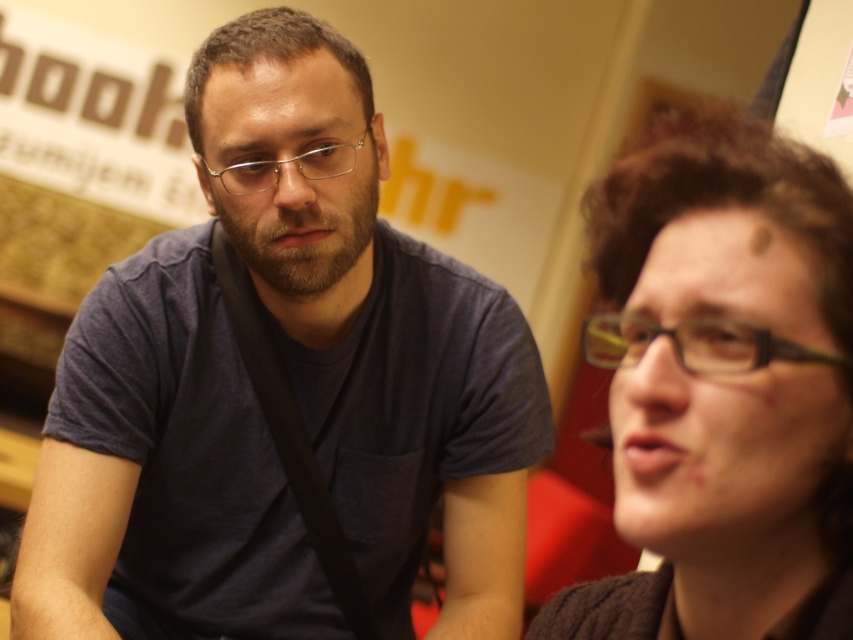
You are a photographer trying to capture a closeup shot of the metallic frame glasses at center and the matte black hair at right. Since the camera can only focus on one subject at a time, which object should you prioritize to ensure the other is in the frame?

The matte black hair at right is positioned on the right side of metallic frame glasses at center, so if you focus on the metallic frame glasses at center, the matte black hair at right will still be in the frame to its right side.